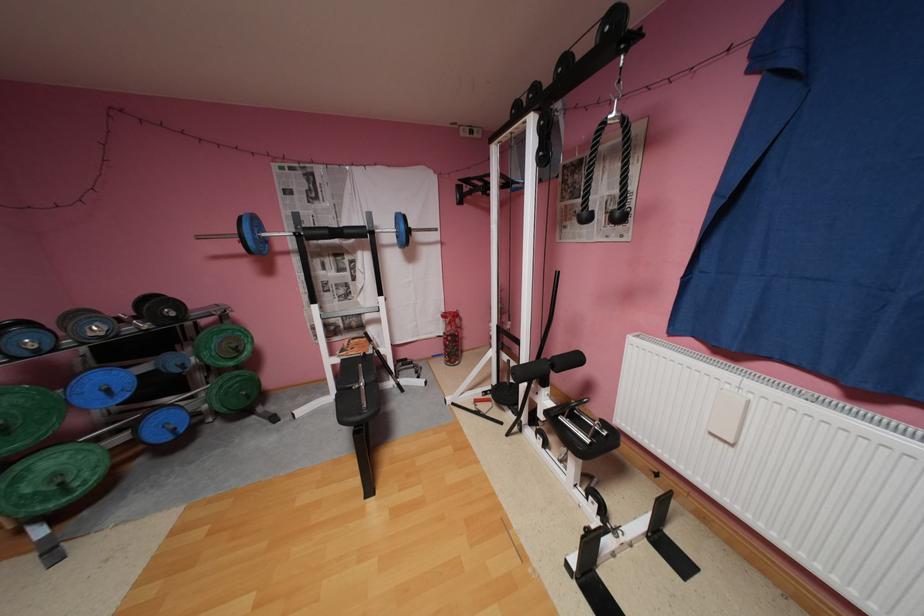
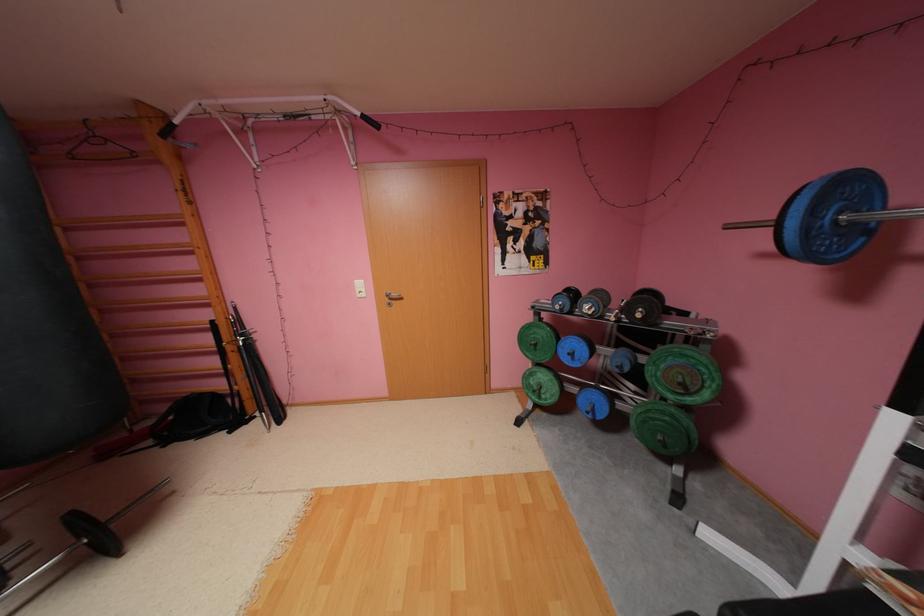
Where in the second image is the point corresponding to (246,347) from the first image?

(690, 384)